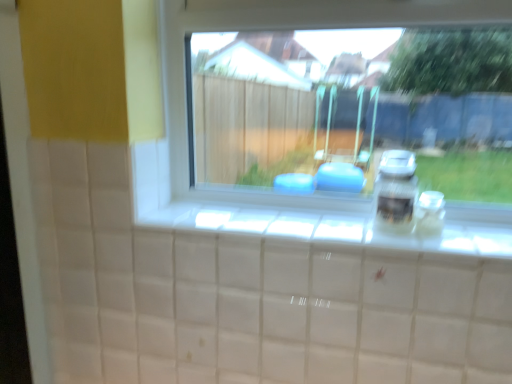
What are the coordinates of `empty space that is to the right of transparent glass jar at right` in the screenshot? It's located at (477, 235).